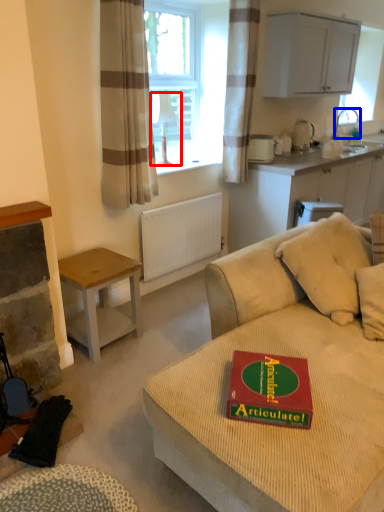
Question: Among these objects, which one is nearest to the camera, lamp (highlighted by a red box) or faucet (highlighted by a blue box)?

Choices:
 (A) lamp
 (B) faucet

Answer: (A)